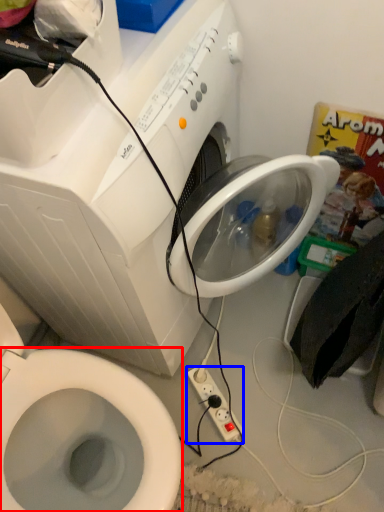
Question: Among these objects, which one is farthest to the camera, bidet (highlighted by a red box) or power plugs and sockets (highlighted by a blue box)?

Choices:
 (A) bidet
 (B) power plugs and sockets

Answer: (B)